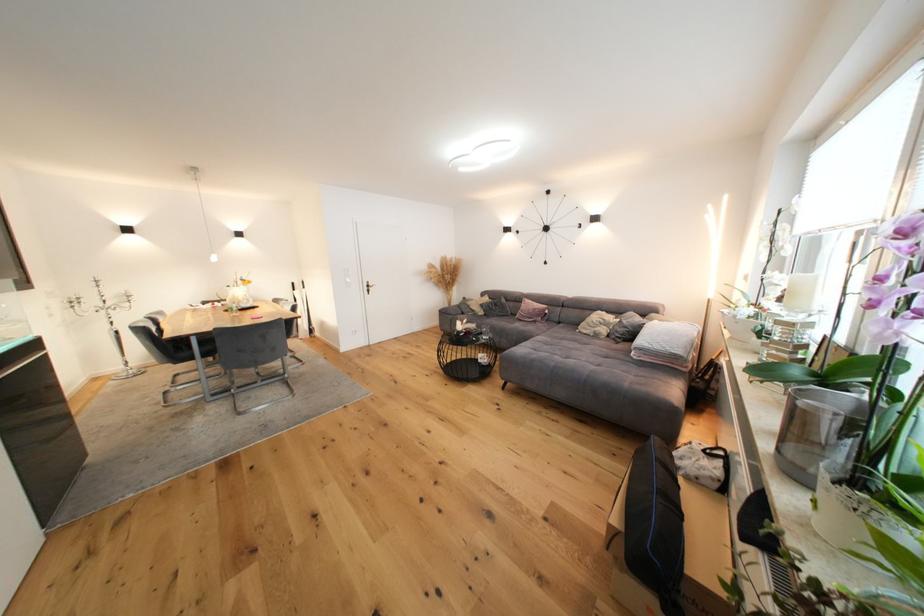
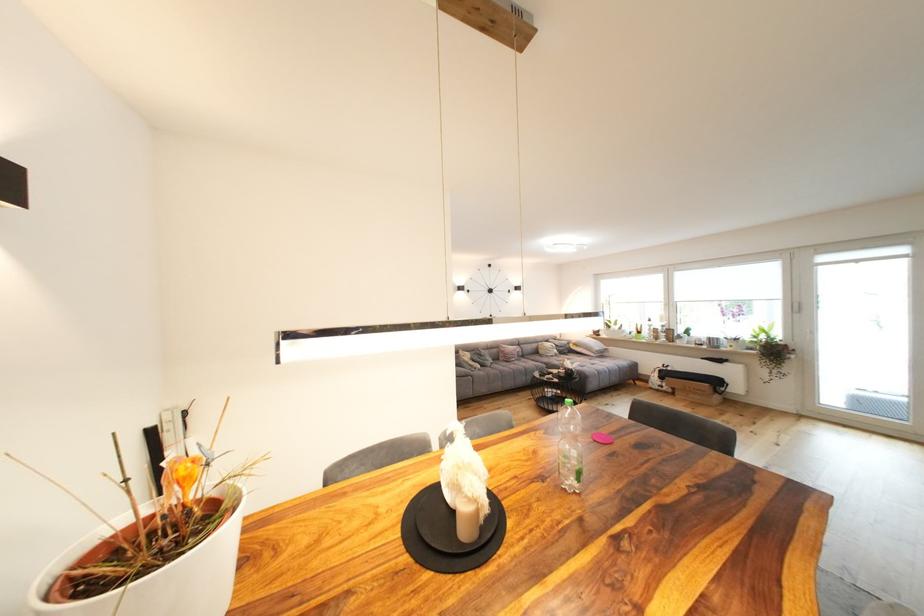
In the second image, find the point that corresponds to (489,315) in the first image.

(485, 368)